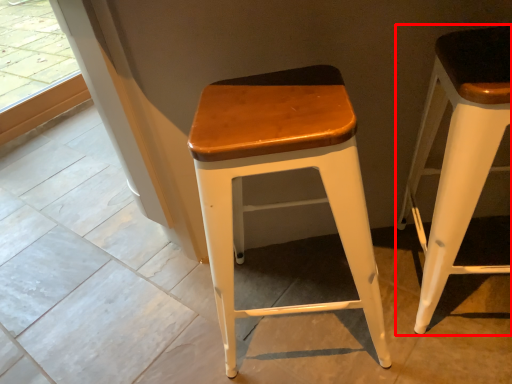
Question: From the image's perspective, what is the correct spatial relationship of stool (annotated by the red box) in relation to stool?

Choices:
 (A) above
 (B) below

Answer: (A)